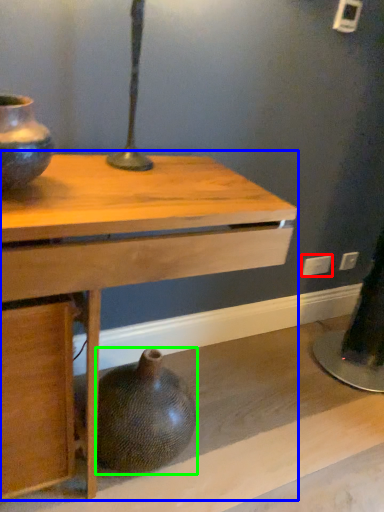
Question: Which is farther away from electric outlet (highlighted by a red box)? table (highlighted by a blue box) or vase (highlighted by a green box)?

Choices:
 (A) table
 (B) vase

Answer: (A)